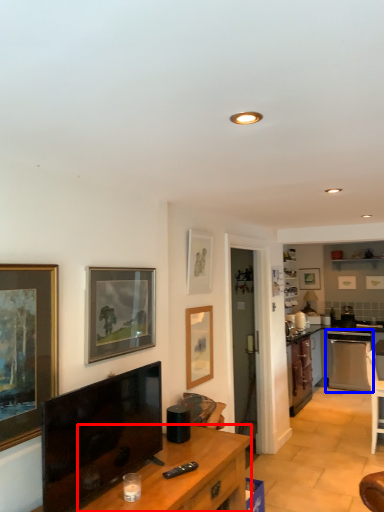
Question: Which point is closer to the camera, desk (highlighted by a red box) or dish washer (highlighted by a blue box)?

Choices:
 (A) desk
 (B) dish washer

Answer: (A)